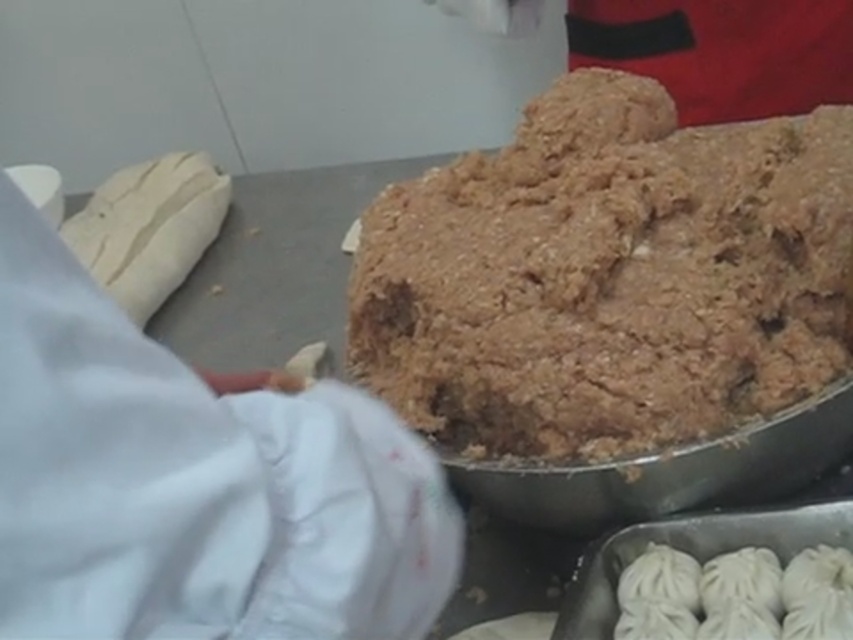
Question: Which object appears closest to the camera in this image?

Choices:
 (A) white fabric glove at upper left
 (B) white matte dumplings at lower right
 (C) brown crumbly dough at center

Answer: (A)

Question: Which object is positioned farthest from the brown crumbly dough at center?

Choices:
 (A) white fabric glove at upper left
 (B) white matte dumplings at lower right

Answer: (A)

Question: Which point appears farthest from the camera in this image?

Choices:
 (A) (656, 360)
 (B) (729, 552)
 (C) (210, 552)

Answer: (B)

Question: Is white fabric glove at upper left to the right of white matte dumplings at lower right from the viewer's perspective?

Choices:
 (A) no
 (B) yes

Answer: (A)

Question: Where is brown crumbly dough at center located in relation to white fabric glove at upper left in the image?

Choices:
 (A) below
 (B) above

Answer: (B)

Question: Does white fabric glove at upper left have a larger size compared to white matte dumplings at lower right?

Choices:
 (A) no
 (B) yes

Answer: (B)